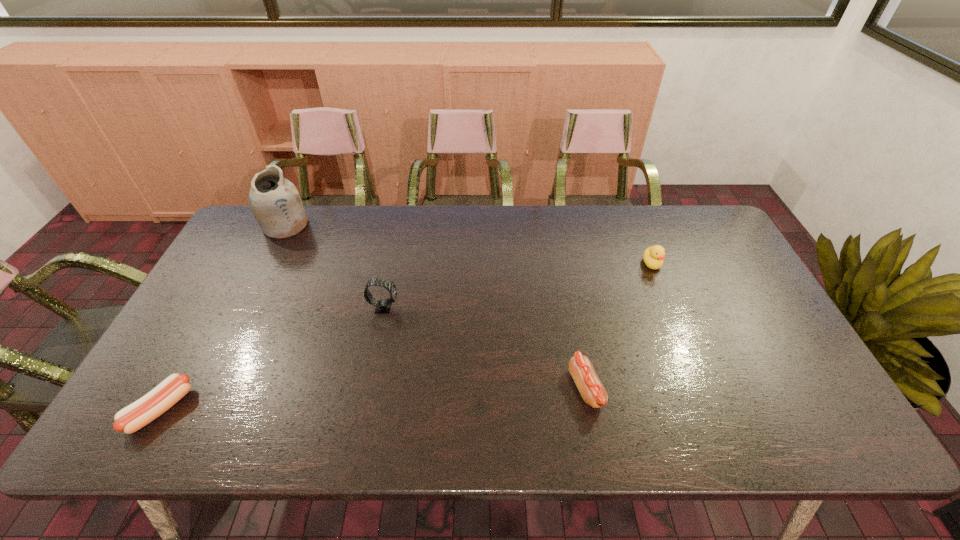
Identify the location of vacant space located on the right of the farthest object. (415, 225).

This screenshot has height=540, width=960. What are the coordinates of `vacant area situated 0.060m on the face of the watch` in the screenshot? It's located at (420, 307).

Locate an element on the screen. The width and height of the screenshot is (960, 540). free location located 0.050m on the face of the third shortest object is located at coordinates (660, 285).

This screenshot has width=960, height=540. I want to click on free space located on the right of the fourth tallest object, so click(747, 389).

Find the location of a particular element. The width and height of the screenshot is (960, 540). free location located 0.170m on the right of the shorter sausage is located at coordinates (260, 409).

The image size is (960, 540). What are the coordinates of `object present at the far edge` in the screenshot? It's located at (275, 202).

Image resolution: width=960 pixels, height=540 pixels. What are the coordinates of `pottery located at the left edge` in the screenshot? It's located at (275, 202).

This screenshot has height=540, width=960. Identify the location of sausage located in the left edge section of the desktop. (133, 417).

What are the coordinates of `object that is at the far left corner` in the screenshot? It's located at click(x=275, y=202).

Locate an element on the screen. The width and height of the screenshot is (960, 540). object positioned at the near left corner is located at coordinates (133, 417).